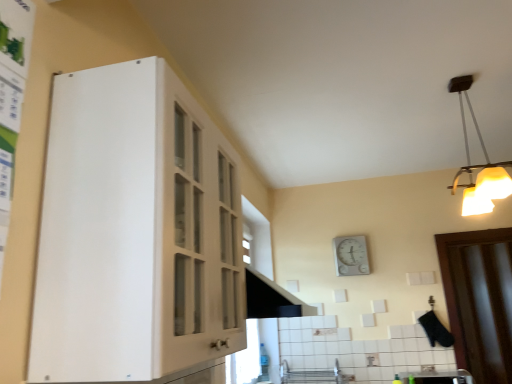
Question: Can you confirm if white plastic light fixture at upper right is smaller than white matte cabinet at left?

Choices:
 (A) no
 (B) yes

Answer: (B)

Question: Is white plastic light fixture at upper right bigger than white matte cabinet at left?

Choices:
 (A) yes
 (B) no

Answer: (B)

Question: Is white plastic light fixture at upper right completely or partially outside of white matte cabinet at left?

Choices:
 (A) yes
 (B) no

Answer: (A)

Question: Does white plastic light fixture at upper right appear on the right side of white matte cabinet at left?

Choices:
 (A) yes
 (B) no

Answer: (A)

Question: Is white plastic light fixture at upper right at the left side of white matte cabinet at left?

Choices:
 (A) no
 (B) yes

Answer: (A)

Question: Considering the positions of white matte cabinet at left and white glossy sink at lower right in the image, is white matte cabinet at left wider or thinner than white glossy sink at lower right?

Choices:
 (A) wide
 (B) thin

Answer: (B)

Question: From a real-world perspective, is white matte cabinet at left above or below white glossy sink at lower right?

Choices:
 (A) below
 (B) above

Answer: (B)

Question: In the image, is white matte cabinet at left on the left side or the right side of white glossy sink at lower right?

Choices:
 (A) left
 (B) right

Answer: (A)

Question: Is white matte cabinet at left taller or shorter than white glossy sink at lower right?

Choices:
 (A) tall
 (B) short

Answer: (A)

Question: From the image's perspective, is brown wooden door at right located above or below white glossy sink at lower right?

Choices:
 (A) above
 (B) below

Answer: (A)

Question: Is brown wooden door at right situated inside white glossy sink at lower right or outside?

Choices:
 (A) inside
 (B) outside

Answer: (B)

Question: Is point (485, 241) positioned closer to the camera than point (437, 372)?

Choices:
 (A) closer
 (B) farther

Answer: (B)

Question: In terms of height, does brown wooden door at right look taller or shorter compared to white glossy sink at lower right?

Choices:
 (A) short
 (B) tall

Answer: (B)

Question: Does point (503, 187) appear closer or farther from the camera than point (353, 256)?

Choices:
 (A) farther
 (B) closer

Answer: (B)

Question: From the image's perspective, is white plastic light fixture at upper right above or below white plastic clock at upper center?

Choices:
 (A) below
 (B) above

Answer: (B)